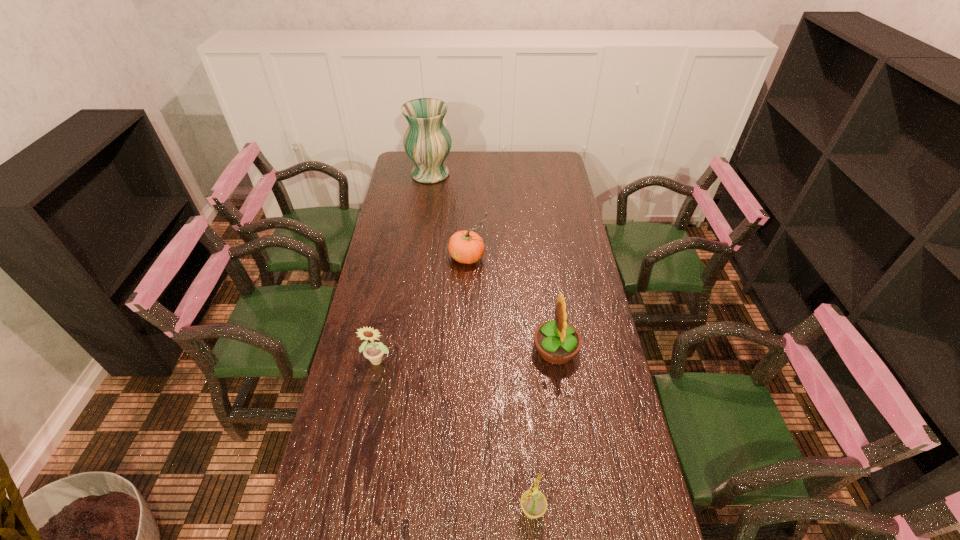
Identify the location of sunflower positioned at the left edge. This screenshot has height=540, width=960. (374, 351).

This screenshot has height=540, width=960. I want to click on object that is at the right edge, so click(x=557, y=342).

Where is `object located in the far left corner section of the desktop`? Image resolution: width=960 pixels, height=540 pixels. object located in the far left corner section of the desktop is located at coordinates (427, 142).

Where is `free location at the far edge of the desktop`? The height and width of the screenshot is (540, 960). free location at the far edge of the desktop is located at coordinates (524, 171).

The height and width of the screenshot is (540, 960). Find the location of `vacant space at the left edge of the desktop`. vacant space at the left edge of the desktop is located at coordinates 366,381.

Where is `vacant position at the right edge of the desktop`? vacant position at the right edge of the desktop is located at coordinates (559, 278).

Identify the location of vacant space at the far left corner of the desktop. (399, 165).

In the image, there is a desktop. At what (x,y) coordinates should I click in order to perform the action: click on vacant space at the far right corner. Please return your answer as a coordinate pair (x, y). The height and width of the screenshot is (540, 960). Looking at the image, I should click on (551, 160).

You are a GUI agent. You are given a task and a screenshot of the screen. Output one action in this format:
    pyautogui.click(x=<x>, y=<y>)
    Task: Click on the vacant space that's between the rightmost object and the second sunflower from left to right
    The height and width of the screenshot is (540, 960).
    Given the screenshot: What is the action you would take?
    pyautogui.click(x=543, y=430)

I want to click on free point between the leftmost sunflower and the fourth object from left to right, so click(x=455, y=435).